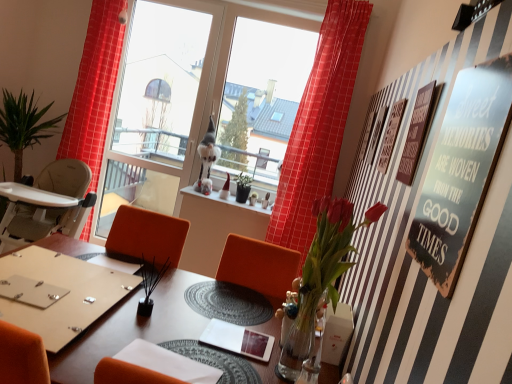
Question: Considering the relative sizes of metallic silver sign at upper right, the 1th bulletin board positioned from the front, and wooden table at center in the image provided, is metallic silver sign at upper right, the 1th bulletin board positioned from the front, wider than wooden table at center?

Choices:
 (A) yes
 (B) no

Answer: (B)

Question: Is metallic silver sign at upper right, which appears as the second bulletin board when viewed from the back, positioned beyond the bounds of wooden table at center?

Choices:
 (A) no
 (B) yes

Answer: (B)

Question: Considering the relative sizes of metallic silver sign at upper right, the 1th bulletin board positioned from the front, and wooden table at center in the image provided, is metallic silver sign at upper right, the 1th bulletin board positioned from the front, bigger than wooden table at center?

Choices:
 (A) no
 (B) yes

Answer: (A)

Question: Is metallic silver sign at upper right, the 1th bulletin board positioned from the front, aimed at wooden table at center?

Choices:
 (A) yes
 (B) no

Answer: (B)

Question: Can you confirm if metallic silver sign at upper right, which appears as the second bulletin board when viewed from the back, is thinner than wooden table at center?

Choices:
 (A) no
 (B) yes

Answer: (B)

Question: From a real-world perspective, is metallic silver sign at upper right, the 1th bulletin board positioned from the front, on wooden table at center?

Choices:
 (A) yes
 (B) no

Answer: (A)

Question: Can you confirm if translucent glass vase at center-right is bigger than red checkered curtain at left, which is counted as the first curtain, starting from the left?

Choices:
 (A) no
 (B) yes

Answer: (A)

Question: Can you confirm if translucent glass vase at center-right is positioned to the right of red checkered curtain at left, which is counted as the first curtain, starting from the left?

Choices:
 (A) no
 (B) yes

Answer: (B)

Question: Is translucent glass vase at center-right positioned before red checkered curtain at left, acting as the 2th curtain starting from the right?

Choices:
 (A) no
 (B) yes

Answer: (B)

Question: Is translucent glass vase at center-right further to camera compared to red checkered curtain at left, acting as the 2th curtain starting from the right?

Choices:
 (A) no
 (B) yes

Answer: (A)

Question: From the image's perspective, is translucent glass vase at center-right under red checkered curtain at left, which is counted as the first curtain, starting from the left?

Choices:
 (A) yes
 (B) no

Answer: (A)

Question: Is translucent glass vase at center-right taller than red checkered curtain at left, acting as the 2th curtain starting from the right?

Choices:
 (A) no
 (B) yes

Answer: (A)

Question: Considering the relative sizes of wooden plaque at upper right, which ranks as the second bulletin board in front-to-back order, and transparent glass window at center, which is counted as the first window screen, starting from the left, in the image provided, is wooden plaque at upper right, which ranks as the second bulletin board in front-to-back order, shorter than transparent glass window at center, which is counted as the first window screen, starting from the left,?

Choices:
 (A) yes
 (B) no

Answer: (A)